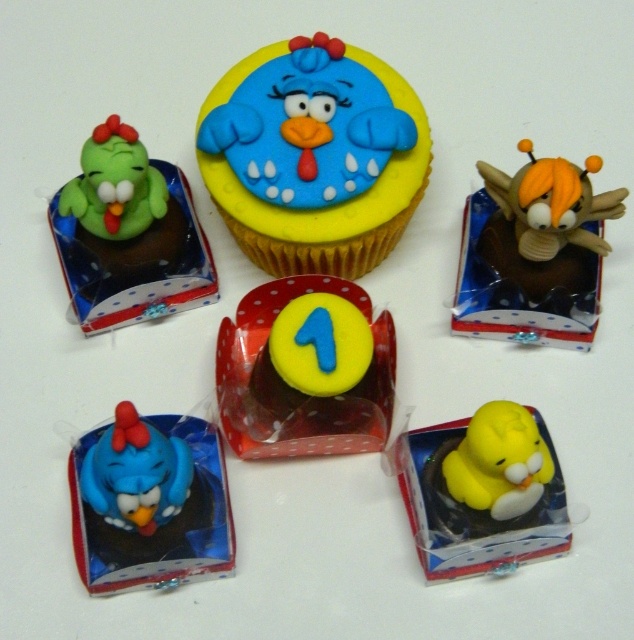
Between orange fuzzy bee at upper right and green matte bird at upper left, which one has more height?

With more height is orange fuzzy bee at upper right.

Who is lower down, orange fuzzy bee at upper right or green matte bird at upper left?

orange fuzzy bee at upper right is below.

The height and width of the screenshot is (640, 634). In order to click on orange fuzzy bee at upper right in this screenshot , I will do `click(552, 204)`.

Locate an element on the screen. The width and height of the screenshot is (634, 640). blue fondant cupcake at center is located at coordinates (313, 156).

The image size is (634, 640). I want to click on blue fondant cupcake at center, so click(x=313, y=156).

How far apart are blue fondant cupcake at center and yellow rubber duck at center?

13.65 inches

The width and height of the screenshot is (634, 640). Identify the location of blue fondant cupcake at center. (313, 156).

Does point (290, 84) come closer to viewer compared to point (474, 572)?

No, it is not.

At what (x,y) coordinates should I click in order to perform the action: click on blue fondant cupcake at center. Please return your answer as a coordinate pair (x, y). The height and width of the screenshot is (640, 634). Looking at the image, I should click on (313, 156).